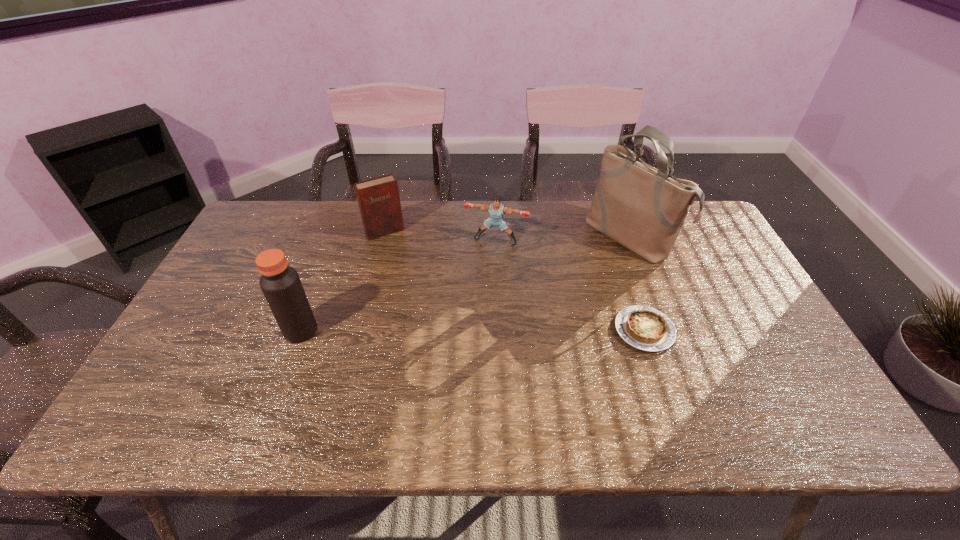
This screenshot has width=960, height=540. Identify the location of diary located in the far edge section of the desktop. (379, 202).

Find the location of `shoulder bag present at the far edge`. shoulder bag present at the far edge is located at coordinates (643, 208).

Locate an element on the screen. object located in the right edge section of the desktop is located at coordinates (643, 208).

You are a GUI agent. You are given a task and a screenshot of the screen. Output one action in this format:
    pyautogui.click(x=<x>, y=<y>)
    Task: Click on the object present at the far right corner
    The height and width of the screenshot is (540, 960).
    Given the screenshot: What is the action you would take?
    pyautogui.click(x=643, y=208)

Where is `free location at the far edge of the desktop`? This screenshot has width=960, height=540. free location at the far edge of the desktop is located at coordinates tap(419, 208).

In the image, there is a desktop. Where is `free space at the near edge`? Image resolution: width=960 pixels, height=540 pixels. free space at the near edge is located at coordinates (742, 396).

Identify the location of vacant space at the left edge. (235, 316).

What are the coordinates of `free space at the right edge of the desktop` in the screenshot? It's located at (784, 349).

Locate an element on the screen. This screenshot has height=540, width=960. vacant area at the near left corner is located at coordinates (199, 396).

In the image, there is a desktop. Find the location of `vacant space at the far right corner`. vacant space at the far right corner is located at coordinates (710, 238).